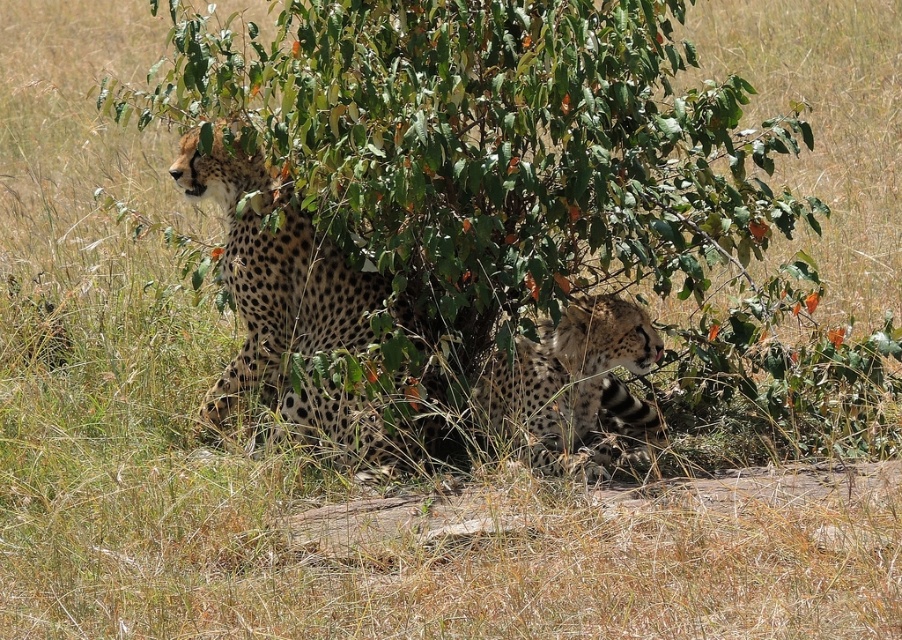
Which is behind, point (235, 282) or point (595, 474)?

Positioned behind is point (235, 282).

Can you confirm if spotted fur cheetah at center is taller than spotted fur cheetah at lower right?

Yes, spotted fur cheetah at center is taller than spotted fur cheetah at lower right.

Identify the location of spotted fur cheetah at center. The width and height of the screenshot is (902, 640). (297, 314).